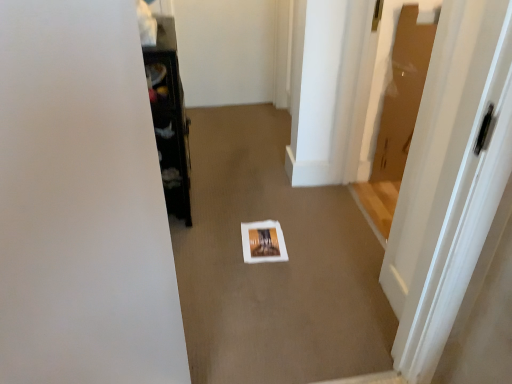
Question: Is white paper at center with white glossy door at center right?

Choices:
 (A) no
 (B) yes

Answer: (A)

Question: Considering the relative sizes of white paper at center and white glossy door at center right in the image provided, is white paper at center wider than white glossy door at center right?

Choices:
 (A) no
 (B) yes

Answer: (B)

Question: Can you confirm if white paper at center is thinner than white glossy door at center right?

Choices:
 (A) no
 (B) yes

Answer: (A)

Question: From a real-world perspective, does white paper at center sit lower than white glossy door at center right?

Choices:
 (A) no
 (B) yes

Answer: (B)

Question: Does white paper at center lie in front of white glossy door at center right?

Choices:
 (A) no
 (B) yes

Answer: (A)

Question: In the image, is white glossy door at center right on the left side or the right side of black glossy cabinet at left?

Choices:
 (A) right
 (B) left

Answer: (A)

Question: Considering the positions of point (443, 177) and point (162, 175), is point (443, 177) closer or farther from the camera than point (162, 175)?

Choices:
 (A) farther
 (B) closer

Answer: (B)

Question: Would you say white glossy door at center right is inside or outside black glossy cabinet at left?

Choices:
 (A) inside
 (B) outside

Answer: (B)

Question: In terms of width, does white glossy door at center right look wider or thinner when compared to black glossy cabinet at left?

Choices:
 (A) wide
 (B) thin

Answer: (A)

Question: Is black glossy cabinet at left taller or shorter than white glossy door at center right?

Choices:
 (A) tall
 (B) short

Answer: (B)

Question: Is black glossy cabinet at left bigger or smaller than white glossy door at center right?

Choices:
 (A) small
 (B) big

Answer: (A)

Question: Considering their positions, is black glossy cabinet at left located in front of or behind white glossy door at center right?

Choices:
 (A) front
 (B) behind

Answer: (B)

Question: Is black glossy cabinet at left inside the boundaries of white glossy door at center right, or outside?

Choices:
 (A) outside
 (B) inside

Answer: (A)

Question: Would you say white glossy door at center right is to the left or to the right of white paper at center in the picture?

Choices:
 (A) left
 (B) right

Answer: (B)

Question: Does point (438, 291) appear closer or farther from the camera than point (252, 251)?

Choices:
 (A) farther
 (B) closer

Answer: (B)